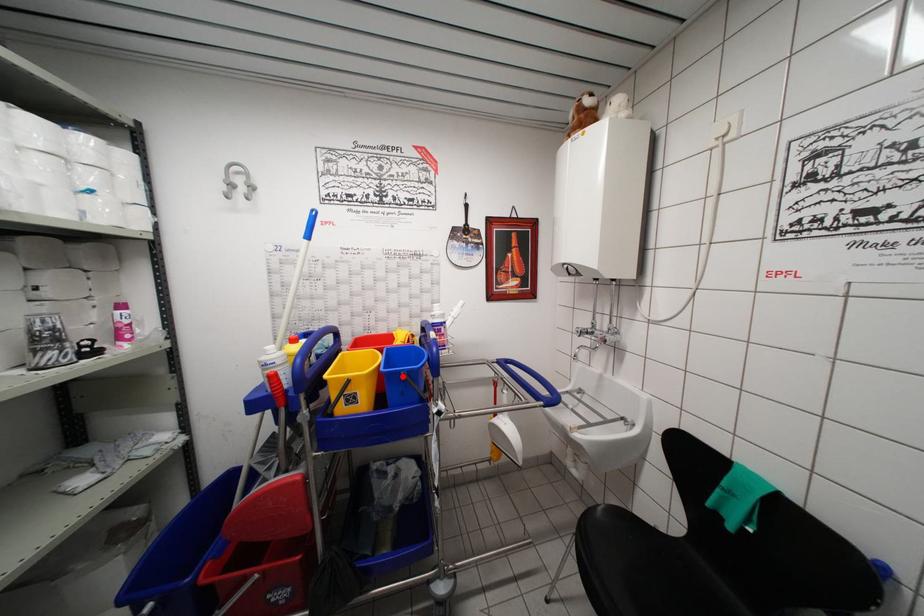
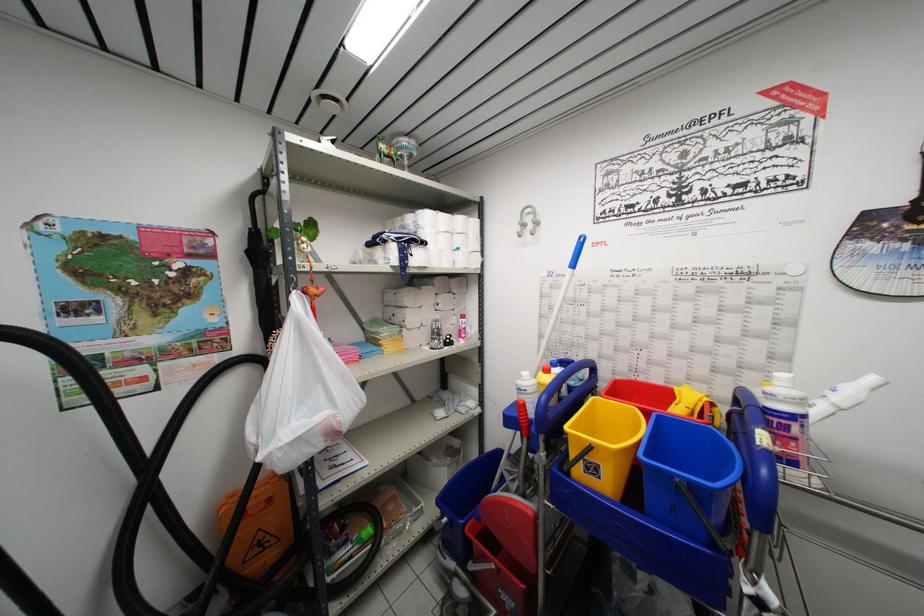
In the second image, find the point that corresponds to the highlighted location in the first image.

(675, 479)